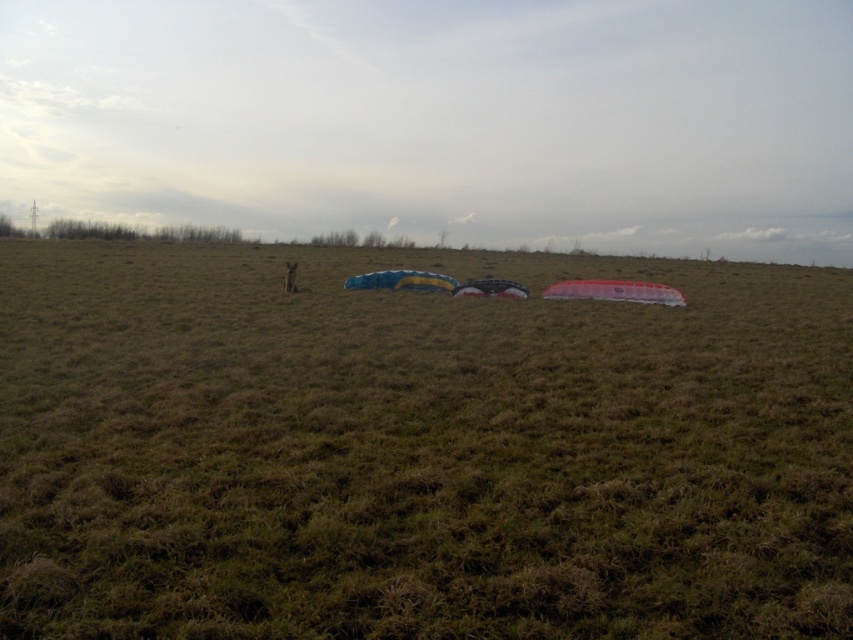
You are a child who wants to pick up the transparent plastic kite at center and the translucent black kite at center. Which kite should you reach for first to grab the one closer to you?

The transparent plastic kite at center is closer to the viewer, so you should reach for it first.

You are standing in the middle of the field and see two points marked on the ground. Which point is closer to you? The points are labeled as point (x=679, y=294) and point (x=460, y=285).

Point (x=679, y=294) is closer to the viewer than point (x=460, y=285).

From the picture: You are a child who wants to fly the blue glossy kite at center and the translucent black kite at center. Since you have only one spool of string, which kite should you choose to fly first so that it can reach higher altitude?

The blue glossy kite at center is bigger than the translucent black kite at center, so it will likely fly higher and should be flown first.